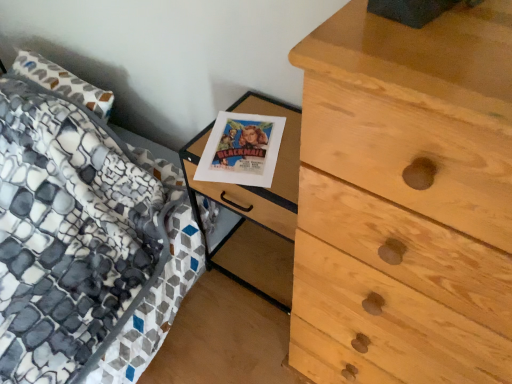
Measure the distance between wooden nightstand at center and camera.

1.06 meters.

The width and height of the screenshot is (512, 384). Describe the element at coordinates (72, 234) in the screenshot. I see `patterned fabric bed at left` at that location.

Locate an element on the screen. Image resolution: width=512 pixels, height=384 pixels. wooden nightstand at center is located at coordinates (253, 189).

Looking at this image, is light brown wood chest of drawers at right at the left side of wooden nightstand at center?

No, light brown wood chest of drawers at right is not to the left of wooden nightstand at center.

Is light brown wood chest of drawers at right placed right next to wooden nightstand at center?

light brown wood chest of drawers at right and wooden nightstand at center are not in contact.

Considering the sizes of light brown wood chest of drawers at right and wooden nightstand at center in the image, is light brown wood chest of drawers at right taller or shorter than wooden nightstand at center?

Considering their sizes, light brown wood chest of drawers at right has more height than wooden nightstand at center.

Consider the image. Considering the sizes of wooden nightstand at center and patterned fabric bed at left in the image, is wooden nightstand at center taller or shorter than patterned fabric bed at left?

wooden nightstand at center is taller than patterned fabric bed at left.

Between wooden nightstand at center and patterned fabric bed at left, which one appears on the right side from the viewer's perspective?

From the viewer's perspective, wooden nightstand at center appears more on the right side.

Could patterned fabric bed at left be considered to be inside wooden nightstand at center?

That's incorrect, patterned fabric bed at left is not inside wooden nightstand at center.

From a real-world perspective, is wooden nightstand at center on patterned fabric bed at left?

Correct, in the physical world, wooden nightstand at center is higher than patterned fabric bed at left.

Is light brown wood chest of drawers at right wider or thinner than patterned fabric bed at left?

light brown wood chest of drawers at right is thinner than patterned fabric bed at left.

What's the angular difference between light brown wood chest of drawers at right and patterned fabric bed at left's facing directions?

The angle between the facing direction of light brown wood chest of drawers at right and the facing direction of patterned fabric bed at left is 0.297 degrees.

Find the location of a particular element. Image resolution: width=512 pixels, height=384 pixels. chest of drawers that is on the right side of patterned fabric bed at left is located at coordinates (405, 200).

Based on their positions, is light brown wood chest of drawers at right located to the left or right of patterned fabric bed at left?

From the image, it's evident that light brown wood chest of drawers at right is to the right of patterned fabric bed at left.

Which is more to the right, patterned fabric bed at left or wooden nightstand at center?

wooden nightstand at center.

From the picture: Is the depth of patterned fabric bed at left greater than that of wooden nightstand at center?

No, the depth of patterned fabric bed at left is less than that of wooden nightstand at center.

From the image's perspective, between patterned fabric bed at left and wooden nightstand at center, who is located below?

wooden nightstand at center appears lower in the image.

Which point is more distant from viewer, (64, 213) or (275, 207)?

The point (64, 213) is behind.

Locate an element on the screen. nightstand that is on the left side of light brown wood chest of drawers at right is located at coordinates (253, 189).

From the image's perspective, which one is positioned lower, wooden nightstand at center or light brown wood chest of drawers at right?

light brown wood chest of drawers at right is shown below in the image.

Is wooden nightstand at center looking in the opposite direction of light brown wood chest of drawers at right?

No, light brown wood chest of drawers at right is not at the back of wooden nightstand at center.

Is wooden nightstand at center not close to light brown wood chest of drawers at right?

wooden nightstand at center is actually quite close to light brown wood chest of drawers at right.

From the image's perspective, does patterned fabric bed at left appear lower than light brown wood chest of drawers at right?

No, from the image's perspective, patterned fabric bed at left is not below light brown wood chest of drawers at right.

Is patterned fabric bed at left aimed at light brown wood chest of drawers at right?

No, patterned fabric bed at left is not turned towards light brown wood chest of drawers at right.

Image resolution: width=512 pixels, height=384 pixels. Identify the location of bed that is behind the light brown wood chest of drawers at right. (72, 234).

Locate an element on the screen. This screenshot has width=512, height=384. the chest of drawers that is in front of the wooden nightstand at center is located at coordinates (405, 200).

You are a GUI agent. You are given a task and a screenshot of the screen. Output one action in this format:
    pyautogui.click(x=<x>, y=<y>)
    Task: Click on the bed on the left of the wooden nightstand at center
    
    Given the screenshot: What is the action you would take?
    click(x=72, y=234)

Considering their positions, is light brown wood chest of drawers at right positioned closer to patterned fabric bed at left than wooden nightstand at center?

wooden nightstand at center.

From the image, which object appears to be nearer to light brown wood chest of drawers at right, wooden nightstand at center or patterned fabric bed at left?

wooden nightstand at center.

Based on their spatial positions, is patterned fabric bed at left or wooden nightstand at center further from light brown wood chest of drawers at right?

The object further to light brown wood chest of drawers at right is patterned fabric bed at left.

Based on their spatial positions, is light brown wood chest of drawers at right or patterned fabric bed at left closer to wooden nightstand at center?

Among the two, light brown wood chest of drawers at right is located nearer to wooden nightstand at center.

Which object lies nearer to the anchor point patterned fabric bed at left, wooden nightstand at center or light brown wood chest of drawers at right?

The object closer to patterned fabric bed at left is wooden nightstand at center.

When comparing their distances from wooden nightstand at center, does patterned fabric bed at left or light brown wood chest of drawers at right seem further?

Based on the image, patterned fabric bed at left appears to be further to wooden nightstand at center.

Identify the location of nightstand between patterned fabric bed at left and light brown wood chest of drawers at right in the horizontal direction. (253, 189).